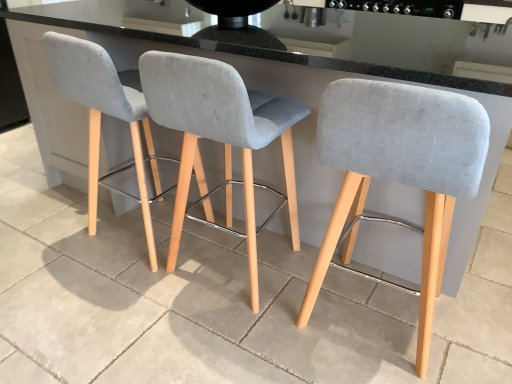
Measure the distance between point (246, 168) and camera.

Point (246, 168) and camera are 4.26 feet apart from each other.

Image resolution: width=512 pixels, height=384 pixels. What do you see at coordinates (404, 7) in the screenshot?
I see `black glossy stove at upper center` at bounding box center [404, 7].

Where is `light gray fabric stool at center, placed as the second chair when sorted from left to right`? light gray fabric stool at center, placed as the second chair when sorted from left to right is located at coordinates (220, 133).

From a real-world perspective, does gray concrete at center sit lower than black glossy stove at upper center?

Yes, from a real-world perspective, gray concrete at center is below black glossy stove at upper center.

Is point (40, 274) farther from camera compared to point (392, 8)?

No, it is in front of (392, 8).

Is gray concrete at center directly adjacent to black glossy stove at upper center?

No, gray concrete at center is not in contact with black glossy stove at upper center.

Does black glossy stove at upper center turn towards light gray fabric stool at center, the 2th chair positioned from the right?

Yes, black glossy stove at upper center is turned towards light gray fabric stool at center, the 2th chair positioned from the right.

Who is bigger, black glossy stove at upper center or light gray fabric stool at center, placed as the second chair when sorted from left to right?

light gray fabric stool at center, placed as the second chair when sorted from left to right.

Does black glossy stove at upper center appear on the right side of light gray fabric stool at center, the 2th chair positioned from the right?

Yes, black glossy stove at upper center is to the right of light gray fabric stool at center, the 2th chair positioned from the right.

Based on the photo, which point is more distant from viewer, (389, 6) or (26, 306)?

Point (389, 6)

Considering the relative positions of black glossy stove at upper center and gray concrete at center in the image provided, is black glossy stove at upper center to the right of gray concrete at center from the viewer's perspective?

Indeed, black glossy stove at upper center is positioned on the right side of gray concrete at center.

Based on the photo, between black glossy stove at upper center and gray concrete at center, which one has larger size?

black glossy stove at upper center.

Is light gray fabric stool at left, the third chair when ordered from right to left, situated inside gray concrete at center or outside?

light gray fabric stool at left, the third chair when ordered from right to left, is not enclosed by gray concrete at center.

Is light gray fabric stool at left, the third chair when ordered from right to left, bigger than gray concrete at center?

Yes, light gray fabric stool at left, the third chair when ordered from right to left, is bigger than gray concrete at center.

What's the angular difference between light gray fabric stool at left, which appears as the first chair when viewed from the left, and gray concrete at center's facing directions?

2.92 degrees separate the facing orientations of light gray fabric stool at left, which appears as the first chair when viewed from the left, and gray concrete at center.

Is light gray fabric stool at left, which appears as the first chair when viewed from the left, looking in the opposite direction of gray concrete at center?

Yes, light gray fabric stool at left, which appears as the first chair when viewed from the left, is positioned with its back facing gray concrete at center.

Would you say light gray fabric stool at center, the 2th chair positioned from the right, is inside or outside black glossy stove at upper center?

light gray fabric stool at center, the 2th chair positioned from the right, lies outside black glossy stove at upper center.

From the image's perspective, is light gray fabric stool at center, placed as the second chair when sorted from left to right, on black glossy stove at upper center?

No, from the image's perspective, light gray fabric stool at center, placed as the second chair when sorted from left to right, is not over black glossy stove at upper center.

From a real-world perspective, is light gray fabric stool at center, the 2th chair positioned from the right, positioned above or below black glossy stove at upper center?

In terms of real-world spatial position, light gray fabric stool at center, the 2th chair positioned from the right, is below black glossy stove at upper center.

Is point (425, 169) closer or farther from the camera than point (140, 323)?

Point (425, 169) is positioned closer to the camera compared to point (140, 323).

Identify the location of concrete directly beneath the light gray fabric stool at center, the 3th chair positioned from the left (from a real-world perspective). The height and width of the screenshot is (384, 512). (73, 319).

In terms of size, does light gray fabric stool at center, the 3th chair positioned from the left, appear bigger or smaller than gray concrete at center?

Clearly, light gray fabric stool at center, the 3th chair positioned from the left, is larger in size than gray concrete at center.

Is light gray fabric stool at left, which appears as the first chair when viewed from the left, positioned with its back to light gray fabric stool at center, the 2th chair positioned from the right?

No.

Does point (203, 173) come in front of point (231, 172)?

That is True.

Who is shorter, light gray fabric stool at left, the third chair when ordered from right to left, or light gray fabric stool at center, the 2th chair positioned from the right?

light gray fabric stool at center, the 2th chair positioned from the right, is shorter.

The image size is (512, 384). Find the location of `concrete below the black glossy stove at upper center (from a real-world perspective)`. concrete below the black glossy stove at upper center (from a real-world perspective) is located at coordinates (73, 319).

This screenshot has height=384, width=512. Identify the location of the 2nd chair to the left of the black glossy stove at upper center, starting your count from the anchor. (220, 133).

Looking at the image, which one is located closer to black glossy stove at upper center, light gray fabric stool at left, the third chair when ordered from right to left, or light gray fabric stool at center, placed as the second chair when sorted from left to right?

The object closer to black glossy stove at upper center is light gray fabric stool at center, placed as the second chair when sorted from left to right.

When comparing their distances from light gray fabric stool at center, the 3th chair positioned from the left, does light gray fabric stool at left, the third chair when ordered from right to left, or black glossy stove at upper center seem further?

black glossy stove at upper center is further to light gray fabric stool at center, the 3th chair positioned from the left.

Estimate the real-world distances between objects in this image. Which object is closer to light gray fabric stool at center, the 1th chair in the right-to-left sequence, light gray fabric stool at center, the 2th chair positioned from the right, or black glossy stove at upper center?

light gray fabric stool at center, the 2th chair positioned from the right.

Considering their positions, is gray concrete at center positioned further to light gray fabric stool at center, the 2th chair positioned from the right, than light gray fabric stool at left, which appears as the first chair when viewed from the left?

Among the two, gray concrete at center is located further to light gray fabric stool at center, the 2th chair positioned from the right.

From the image, which object appears to be farther from light gray fabric stool at left, the third chair when ordered from right to left, light gray fabric stool at center, the 3th chair positioned from the left, or black glossy stove at upper center?

The object further to light gray fabric stool at left, the third chair when ordered from right to left, is black glossy stove at upper center.

Considering their positions, is light gray fabric stool at left, the third chair when ordered from right to left, positioned further to light gray fabric stool at center, placed as the second chair when sorted from left to right, than gray concrete at center?

gray concrete at center is further to light gray fabric stool at center, placed as the second chair when sorted from left to right.

Looking at this image, considering their positions, is black glossy stove at upper center positioned further to light gray fabric stool at center, the 2th chair positioned from the right, than gray concrete at center?

The object further to light gray fabric stool at center, the 2th chair positioned from the right, is black glossy stove at upper center.

Estimate the real-world distances between objects in this image. Which object is further from light gray fabric stool at center, the 2th chair positioned from the right, light gray fabric stool at center, the 3th chair positioned from the left, or black glossy stove at upper center?

black glossy stove at upper center is positioned further to the anchor light gray fabric stool at center, the 2th chair positioned from the right.

Where is `chair between light gray fabric stool at center, the 2th chair positioned from the right, and black glossy stove at upper center from front to back`? chair between light gray fabric stool at center, the 2th chair positioned from the right, and black glossy stove at upper center from front to back is located at coordinates (106, 114).

You are a GUI agent. You are given a task and a screenshot of the screen. Output one action in this format:
    pyautogui.click(x=<x>, y=<y>)
    Task: Click on the chair between light gray fabric stool at left, the third chair when ordered from right to left, and light gray fabric stool at center, the 1th chair in the right-to-left sequence
    This screenshot has height=384, width=512.
    Given the screenshot: What is the action you would take?
    pyautogui.click(x=220, y=133)